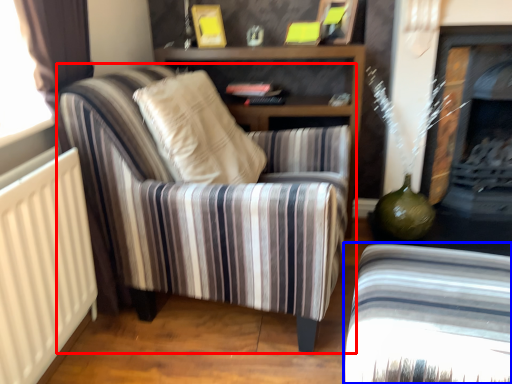
Question: Which point is closer to the camera, chair (highlighted by a red box) or chair (highlighted by a blue box)?

Choices:
 (A) chair
 (B) chair

Answer: (B)